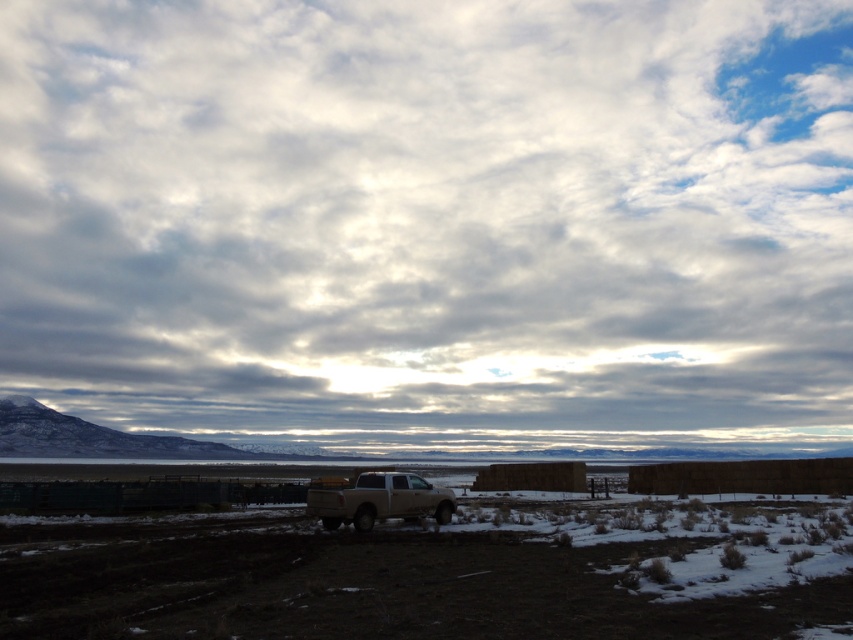
You are a farmer planning to plant crops in the brown dirt field at center. You need to check the weather forecast. Which direction should you look to see the cloudy sky at upper center to estimate the weather?

The cloudy sky at upper center is to the left of the brown dirt field at center. To check the weather, you should look towards the left direction of the brown dirt field at center to observe the cloudy sky at upper center.

From the picture: You are a farmer who needs to drive your matte white truck at center to the brown dirt field at center. Based on the scene, can you determine if the truck is facing the direction of the field?

The brown dirt field at center is positioned on the right side of matte white truck at center. Since the truck is facing slightly towards the right side of the frame, it is facing the direction of the brown dirt field at center.